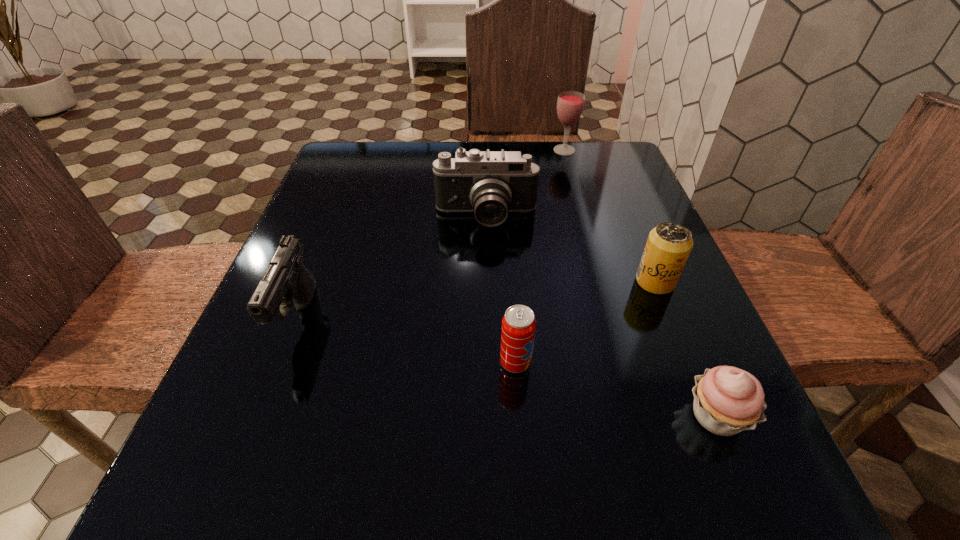
Find the location of a particular element. vacant region that satisfies the following two spatial constraints: 1. at the barrel of the nearest object; 2. on the right side of the pistol is located at coordinates (260, 416).

Identify the location of free spot that satisfies the following two spatial constraints: 1. at the barrel of the soda can; 2. on the right side of the pistol. (281, 362).

I want to click on free spot that satisfies the following two spatial constraints: 1. at the barrel of the soda can; 2. on the left side of the leftmost object, so click(281, 362).